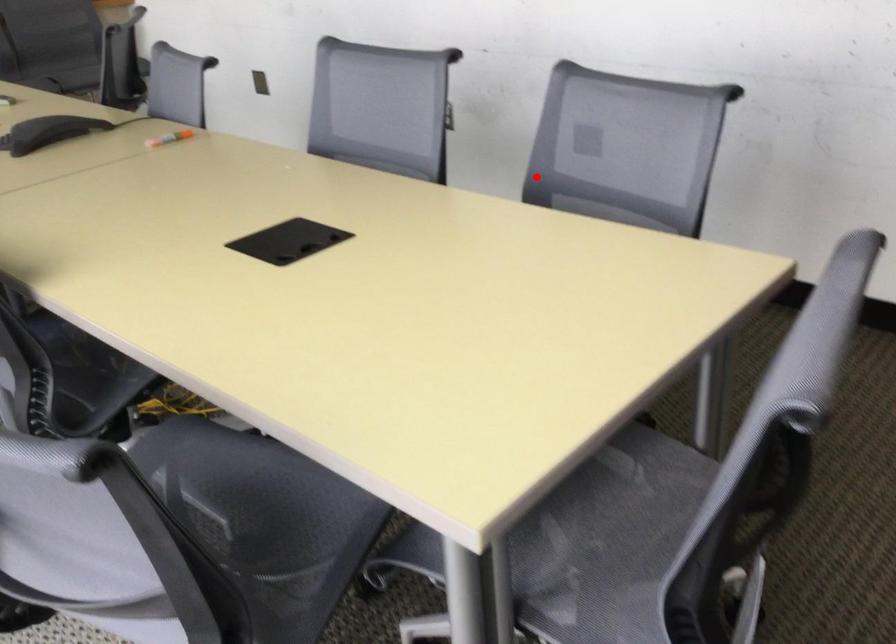
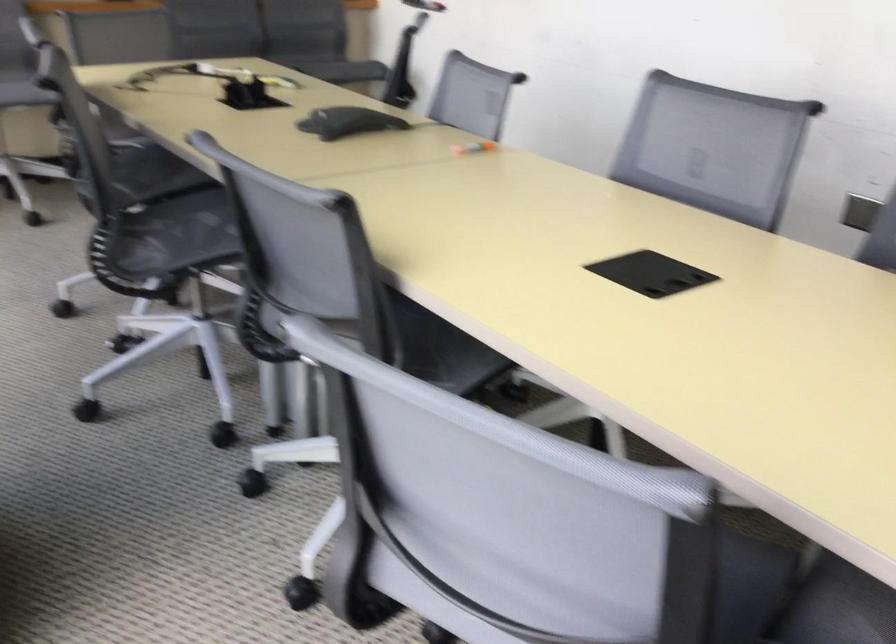
The point at the highlighted location is marked in the first image. Where is the corresponding point in the second image?

(879, 241)